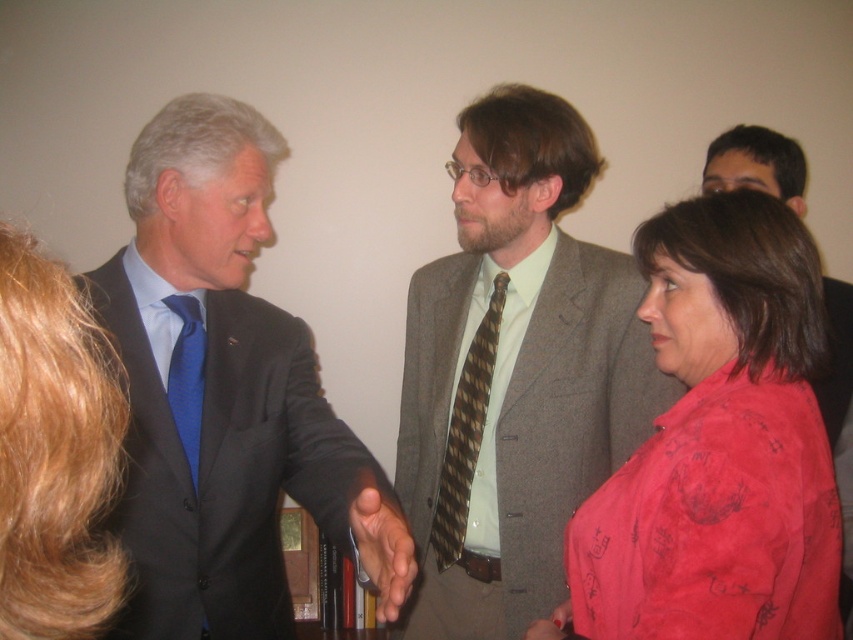
You are a photographer setting up for a group photo in the scene. You need to ensure that the matte black suit at center and the blue silk tie at left are clearly visible in the frame. Given that your camera has a minimum focus distance of 5.5 inches, will you be able to focus on both objects without moving the camera closer?

The matte black suit at center is only 5.40 inches away from the blue silk tie at left. Since the camera requires a minimum focus distance of 5.5 inches, the distance between them is slightly less than required. Therefore, the camera may not be able to focus on both objects simultaneously without moving closer.

Based on the photo, you are standing at the point labeled point [196,316] in the image. Can you see the point labeled point [581,390] behind you?

Yes, since point [581,390] is behind point [196,316], you can see it behind you.